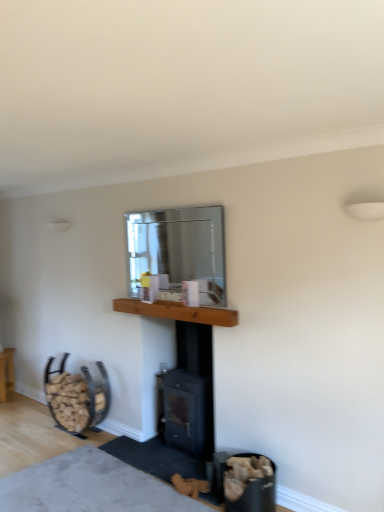
Find the location of a particular element. This screenshot has width=384, height=512. vacant space underneath wooden mantle at center (from a real-world perspective) is located at coordinates (172, 451).